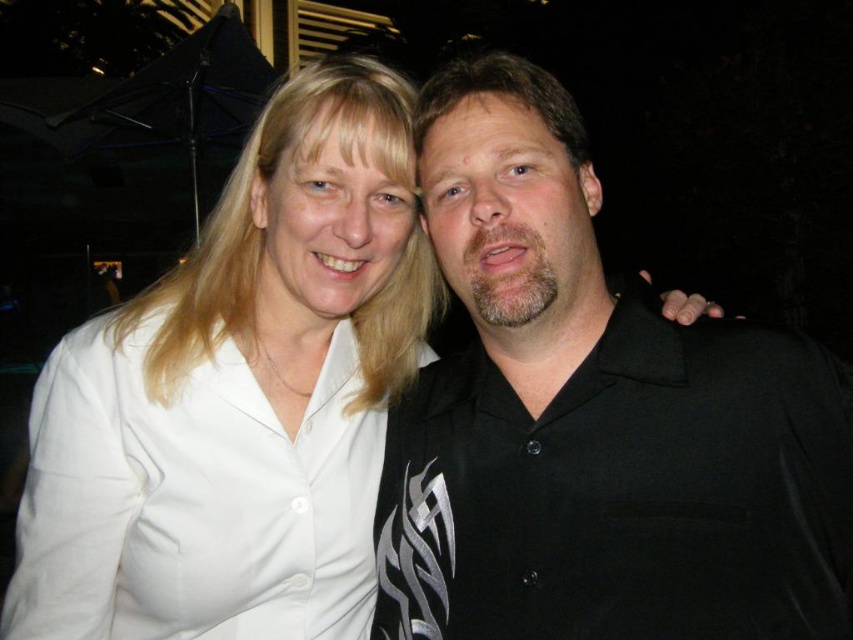
Can you confirm if black matte shirt at center is taller than white smooth shirt at upper left?

Incorrect, black matte shirt at center's height is not larger of white smooth shirt at upper left's.

Does black matte shirt at center lie in front of white smooth shirt at upper left?

Yes, it is in front of white smooth shirt at upper left.

Identify the location of black matte shirt at center. The image size is (853, 640). (595, 419).